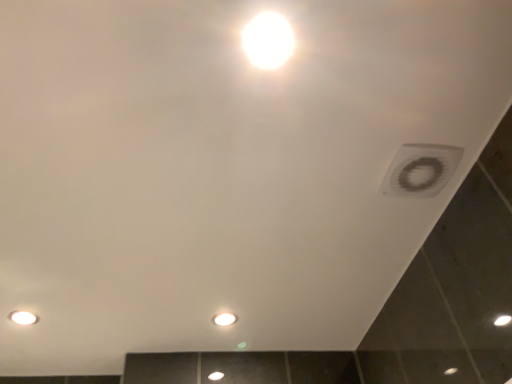
Question: Does white glossy light bulb at center, marked as the 2th light bulb in a right-to-left arrangement, have a lesser height compared to matte white light bulb at lower left, the third light bulb from the right?

Choices:
 (A) yes
 (B) no

Answer: (B)

Question: Can you confirm if white glossy light bulb at center, which ranks as the 3th light bulb in top-to-bottom order, is wider than matte white light bulb at lower left, which ranks as the first light bulb in left-to-right order?

Choices:
 (A) yes
 (B) no

Answer: (B)

Question: From the image's perspective, is white glossy light bulb at center, which ranks as the 3th light bulb in top-to-bottom order, located above matte white light bulb at lower left, the third light bulb from the right?

Choices:
 (A) no
 (B) yes

Answer: (A)

Question: Is white glossy light bulb at center, which is the first light bulb from bottom to top, not near matte white light bulb at lower left, the 2th light bulb when ordered from back to front?

Choices:
 (A) yes
 (B) no

Answer: (B)

Question: Is matte white light bulb at lower left, the 2th light bulb in the front-to-back sequence, surrounded by white glossy light bulb at center, which ranks as the 3th light bulb in top-to-bottom order?

Choices:
 (A) no
 (B) yes

Answer: (A)

Question: Is white matte vent at upper right in front of or behind matte white light bulb at lower left, which is counted as the 2th light bulb, starting from the top, in the image?

Choices:
 (A) front
 (B) behind

Answer: (A)

Question: Does point tap(408, 177) appear closer or farther from the camera than point tap(35, 319)?

Choices:
 (A) closer
 (B) farther

Answer: (A)

Question: From a real-world perspective, is white matte vent at upper right physically located above or below matte white light bulb at lower left, which ranks as the first light bulb in left-to-right order?

Choices:
 (A) below
 (B) above

Answer: (A)

Question: Would you say white matte vent at upper right is to the left or to the right of matte white light bulb at lower left, arranged as the 2th light bulb when ordered from the bottom, in the picture?

Choices:
 (A) left
 (B) right

Answer: (B)

Question: Considering the positions of point (284, 36) and point (393, 192), is point (284, 36) closer or farther from the camera than point (393, 192)?

Choices:
 (A) farther
 (B) closer

Answer: (B)

Question: Do you think bright white glossy light bulb at upper center, positioned as the third light bulb in back-to-front order, is within white matte vent at upper right, or outside of it?

Choices:
 (A) inside
 (B) outside

Answer: (B)

Question: Considering the positions of bright white glossy light bulb at upper center, which is the 3th light bulb from bottom to top, and white matte vent at upper right in the image, is bright white glossy light bulb at upper center, which is the 3th light bulb from bottom to top, wider or thinner than white matte vent at upper right?

Choices:
 (A) thin
 (B) wide

Answer: (A)

Question: From the image's perspective, is bright white glossy light bulb at upper center, which appears as the third light bulb when viewed from the left, located above or below white matte vent at upper right?

Choices:
 (A) below
 (B) above

Answer: (B)

Question: From a real-world perspective, is bright white glossy light bulb at upper center, which appears as the third light bulb when viewed from the left, above or below matte white light bulb at lower left, arranged as the 2th light bulb when ordered from the bottom?

Choices:
 (A) above
 (B) below

Answer: (B)

Question: Do you think bright white glossy light bulb at upper center, positioned as the third light bulb in back-to-front order, is within matte white light bulb at lower left, the 2th light bulb in the front-to-back sequence, or outside of it?

Choices:
 (A) inside
 (B) outside

Answer: (B)